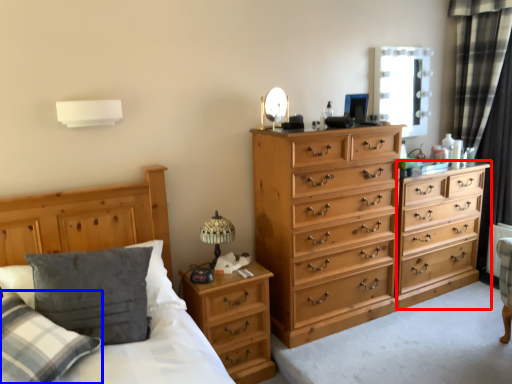
Question: Which object appears closest to the camera in this image, chest of drawers (highlighted by a red box) or pillow (highlighted by a blue box)?

Choices:
 (A) chest of drawers
 (B) pillow

Answer: (B)